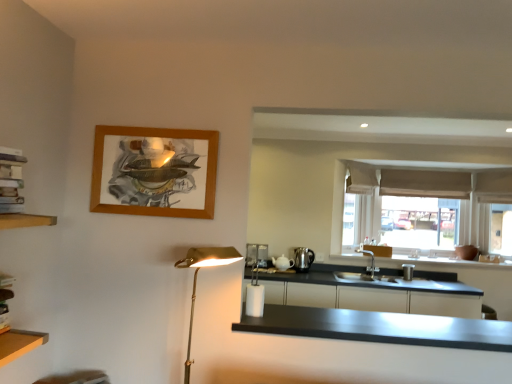
Image resolution: width=512 pixels, height=384 pixels. Identify the location of free space above wooden frame at upper left (from a real-world perspective). (159, 126).